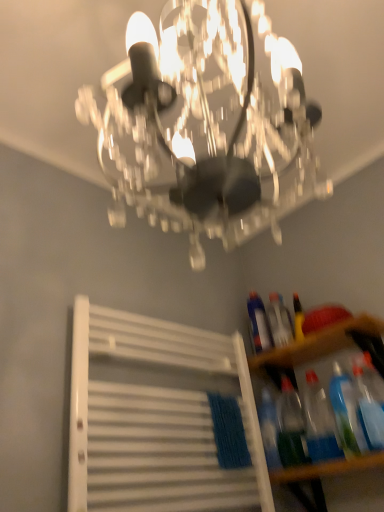
Question: Is translucent plastic bottle at right, which is counted as the fifth bottle, starting from the front, positioned beyond the bounds of translucent plastic bottles at lower right, which is counted as the first bottle, starting from the front?

Choices:
 (A) yes
 (B) no

Answer: (A)

Question: Can you confirm if translucent plastic bottle at right, which is counted as the fifth bottle, starting from the front, is positioned to the left of translucent plastic bottles at lower right, which is counted as the first bottle, starting from the front?

Choices:
 (A) yes
 (B) no

Answer: (A)

Question: Is translucent plastic bottle at right, which is counted as the fifth bottle, starting from the front, closer to camera compared to translucent plastic bottles at lower right, marked as the 5th bottle in a back-to-front arrangement?

Choices:
 (A) no
 (B) yes

Answer: (A)

Question: Is translucent plastic bottle at right, which is counted as the fifth bottle, starting from the front, to the right of translucent plastic bottles at lower right, marked as the 5th bottle in a back-to-front arrangement, from the viewer's perspective?

Choices:
 (A) yes
 (B) no

Answer: (B)

Question: Is translucent plastic bottle at right, positioned as the 1th bottle in back-to-front order, shorter than translucent plastic bottles at lower right, which is counted as the first bottle, starting from the front?

Choices:
 (A) no
 (B) yes

Answer: (A)

Question: Is translucent plastic bottle at right, positioned as the 1th bottle in back-to-front order, not close to translucent plastic bottles at lower right, which is counted as the first bottle, starting from the front?

Choices:
 (A) yes
 (B) no

Answer: (B)

Question: Considering the relative sizes of transparent plastic bottles at lower right and translucent plastic bottle at lower right, the 2th bottle positioned from the front, in the image provided, is transparent plastic bottles at lower right shorter than translucent plastic bottle at lower right, the 2th bottle positioned from the front,?

Choices:
 (A) no
 (B) yes

Answer: (B)

Question: Does transparent plastic bottles at lower right have a smaller size compared to translucent plastic bottle at lower right, placed as the 4th bottle when sorted from back to front?

Choices:
 (A) no
 (B) yes

Answer: (A)

Question: From the image's perspective, is transparent plastic bottles at lower right located above translucent plastic bottle at lower right, the 2th bottle positioned from the front?

Choices:
 (A) yes
 (B) no

Answer: (A)

Question: From the image's perspective, does transparent plastic bottles at lower right appear lower than translucent plastic bottle at lower right, the 2th bottle positioned from the front?

Choices:
 (A) no
 (B) yes

Answer: (A)

Question: Is transparent plastic bottles at lower right wider than translucent plastic bottle at lower right, the 2th bottle positioned from the front?

Choices:
 (A) yes
 (B) no

Answer: (A)

Question: Considering the relative positions of transparent plastic bottles at lower right and translucent plastic bottle at lower right, the 2th bottle positioned from the front, in the image provided, is transparent plastic bottles at lower right to the left of translucent plastic bottle at lower right, the 2th bottle positioned from the front, from the viewer's perspective?

Choices:
 (A) yes
 (B) no

Answer: (B)

Question: Is transparent plastic bottles at lower right outside of translucent plastic bottle at lower right, positioned as the 3th bottle in front-to-back order?

Choices:
 (A) yes
 (B) no

Answer: (A)